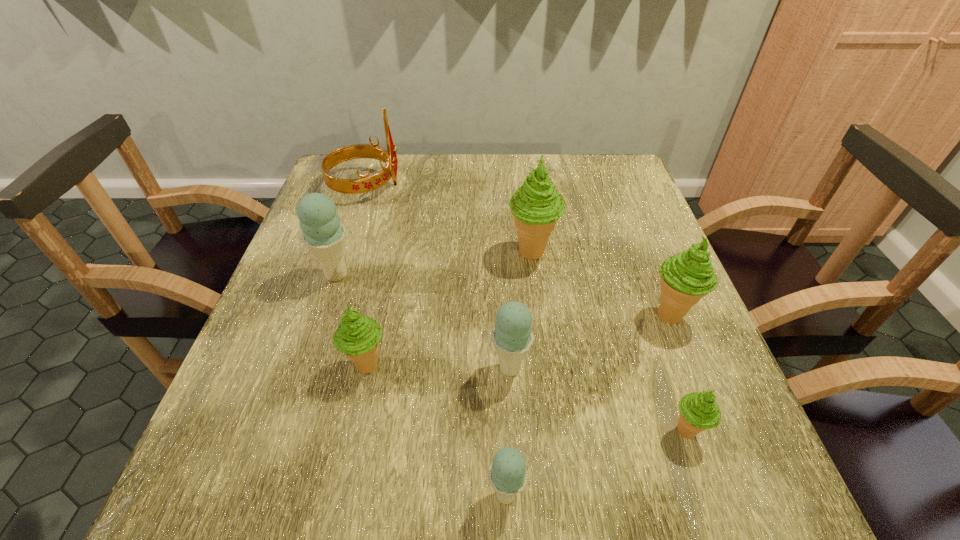
Find the location of a particular element. This screenshot has height=540, width=960. vacant area at the left edge of the desktop is located at coordinates (281, 324).

Identify the location of vacant region at the right edge. (604, 246).

Where is `vacant area at the far left corner of the desktop`? The height and width of the screenshot is (540, 960). vacant area at the far left corner of the desktop is located at coordinates (334, 201).

This screenshot has height=540, width=960. What are the coordinates of `vacant space at the near left corner of the desktop` in the screenshot? It's located at (242, 461).

Locate an element on the screen. Image resolution: width=960 pixels, height=540 pixels. vacant area at the far right corner is located at coordinates (632, 177).

Image resolution: width=960 pixels, height=540 pixels. In order to click on vacant area between the nearest object and the second nearest object in this screenshot , I will do `click(596, 463)`.

You are a GUI agent. You are given a task and a screenshot of the screen. Output one action in this format:
    pyautogui.click(x=<x>, y=<y>)
    Task: Click on the free spot between the second biggest blue ice cream and the fifth nearest ice cream
    
    Given the screenshot: What is the action you would take?
    pyautogui.click(x=590, y=341)

Where is `free space between the second smallest green icecream and the second biggest blue ice cream`? free space between the second smallest green icecream and the second biggest blue ice cream is located at coordinates (439, 367).

This screenshot has height=540, width=960. I want to click on empty space that is in between the second nearest object and the second farthest blue ice cream, so click(x=598, y=400).

Locate an element on the screen. The width and height of the screenshot is (960, 540). free space that is in between the nearest object and the sixth farthest ice cream is located at coordinates (596, 463).